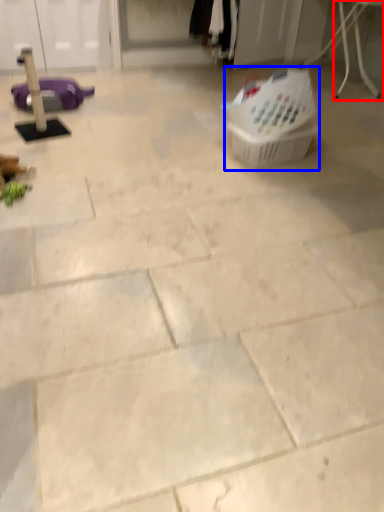
Question: Which object appears farthest to the camera in this image, furniture (highlighted by a red box) or basket (highlighted by a blue box)?

Choices:
 (A) furniture
 (B) basket

Answer: (A)